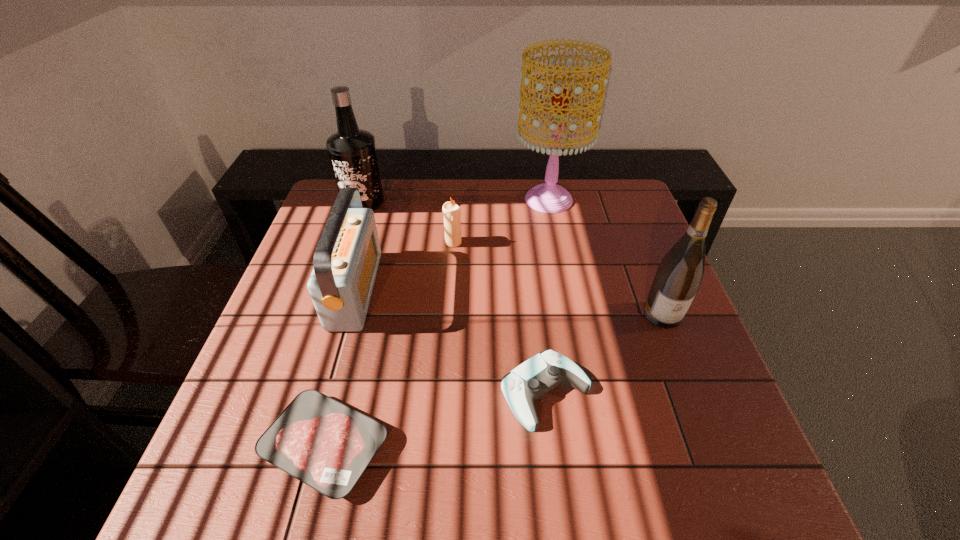
Where is `vacant space situated 0.070m on the label of the wine bottle`? Image resolution: width=960 pixels, height=540 pixels. vacant space situated 0.070m on the label of the wine bottle is located at coordinates tap(679, 355).

The height and width of the screenshot is (540, 960). I want to click on vacant position located 0.110m on the front-facing side of the fourth shortest object, so click(x=418, y=289).

At what (x,y) coordinates should I click in order to perform the action: click on vacant space located on the left of the fifth nearest object. Please return your answer as a coordinate pair (x, y). Looking at the image, I should click on (391, 242).

Where is `free space located on the back of the control`? The width and height of the screenshot is (960, 540). free space located on the back of the control is located at coordinates (534, 297).

Locate an element on the screen. free space located on the back of the shortest object is located at coordinates (352, 341).

Where is `lampshade situated at the far edge`? This screenshot has height=540, width=960. lampshade situated at the far edge is located at coordinates click(x=549, y=197).

I want to click on liquor located at the far edge, so coord(352,151).

Identify the location of object situated at the near edge. (327, 445).

Locate an element on the screen. liquor present at the left edge is located at coordinates (352, 151).

The image size is (960, 540). I want to click on radio receiver positioned at the left edge, so click(346, 259).